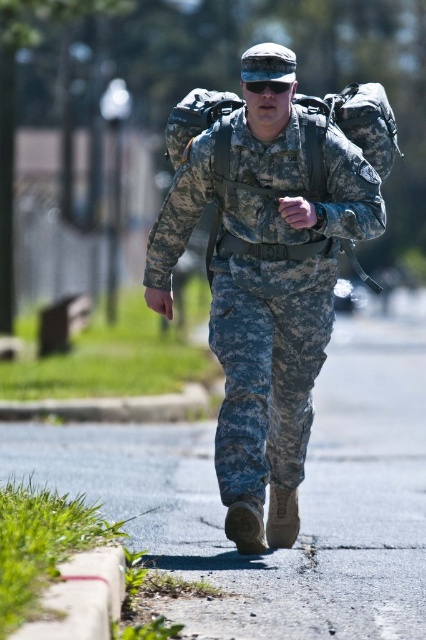
Question: Which of these objects is positioned closest to the asphalt pavement at center?

Choices:
 (A) camouflage fabric uniform at center
 (B) black matte goggles at center

Answer: (A)

Question: Is asphalt pavement at center smaller than black matte goggles at center?

Choices:
 (A) yes
 (B) no

Answer: (B)

Question: Is camouflage fabric uniform at center to the left of black matte goggles at center from the viewer's perspective?

Choices:
 (A) yes
 (B) no

Answer: (A)

Question: Which object appears closest to the camera in this image?

Choices:
 (A) black matte goggles at center
 (B) camouflage fabric uniform at center
 (C) asphalt pavement at center

Answer: (C)

Question: Which of the following is the closest to the observer?

Choices:
 (A) camouflage fabric uniform at center
 (B) black matte goggles at center
 (C) asphalt pavement at center

Answer: (C)

Question: Does asphalt pavement at center have a larger size compared to camouflage fabric uniform at center?

Choices:
 (A) yes
 (B) no

Answer: (A)